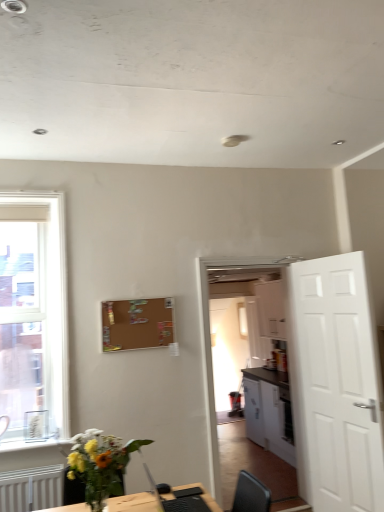
Describe the element at coordinates (268, 412) in the screenshot. I see `white glossy cabinet at center` at that location.

Image resolution: width=384 pixels, height=512 pixels. Describe the element at coordinates (178, 497) in the screenshot. I see `black plastic computer at lower center` at that location.

At what (x,y) coordinates should I click in order to perform the action: click on translucent glass vase at lower left. Please return your answer as a coordinate pair (x, y). This screenshot has width=384, height=512. Looking at the image, I should click on (98, 466).

Identify the location of clear glass window at left. Image resolution: width=384 pixels, height=512 pixels. (33, 312).

Image resolution: width=384 pixels, height=512 pixels. Describe the element at coordinates (33, 312) in the screenshot. I see `clear glass window at left` at that location.

Image resolution: width=384 pixels, height=512 pixels. In order to click on white glossy cabinet at center in this screenshot , I will do `click(268, 412)`.

From a real-world perspective, which object stands above the other?

white matte door at right.

Is white glossy cabinet at center in front of white matte door at right?

No, the depth of white glossy cabinet at center is greater than that of white matte door at right.

Does white glossy cabinet at center turn towards white matte door at right?

No, white glossy cabinet at center is not turned towards white matte door at right.

Considering the relative sizes of white glossy cabinet at center and white matte door at right in the image provided, is white glossy cabinet at center taller than white matte door at right?

In fact, white glossy cabinet at center may be shorter than white matte door at right.

This screenshot has width=384, height=512. Find the location of `computer behind the translucent glass vase at lower left`. computer behind the translucent glass vase at lower left is located at coordinates (178, 497).

Is black plastic computer at lower center not close to translucent glass vase at lower left?

That's not correct — black plastic computer at lower center is a little close to translucent glass vase at lower left.

Is black plastic computer at lower center surrounding translucent glass vase at lower left?

No, translucent glass vase at lower left is not inside black plastic computer at lower center.

Can you confirm if black plastic computer at lower center is thinner than translucent glass vase at lower left?

Yes, black plastic computer at lower center is thinner than translucent glass vase at lower left.

Between white glossy window sill at lower left and white glossy cabinet at center, which one has smaller size?

With smaller size is white glossy window sill at lower left.

Does white glossy window sill at lower left touch white glossy cabinet at center?

They are not placed beside each other.

How far apart are white glossy window sill at lower left and white glossy cabinet at center?

A distance of 10.42 feet exists between white glossy window sill at lower left and white glossy cabinet at center.

Is white glossy window sill at lower left oriented away from white glossy cabinet at center?

white glossy window sill at lower left is not turned away from white glossy cabinet at center.

Measure the distance between brown matte bulletin board at upper center and clear glass window at left.

brown matte bulletin board at upper center and clear glass window at left are 23.33 inches apart.

From the image's perspective, would you say brown matte bulletin board at upper center is shown under clear glass window at left?

Indeed, from the image's perspective, brown matte bulletin board at upper center is shown beneath clear glass window at left.

Where is `bulletin board below the clear glass window at left (from a real-world perspective)`? This screenshot has height=512, width=384. bulletin board below the clear glass window at left (from a real-world perspective) is located at coordinates (137, 324).

How many degrees apart are the facing directions of brown matte bulletin board at upper center and clear glass window at left?

0.755 degrees.

Between white glossy cabinet at center and white glossy window sill at lower left, which one appears on the left side from the viewer's perspective?

From the viewer's perspective, white glossy window sill at lower left appears more on the left side.

How different are the orientations of white glossy cabinet at center and white glossy window sill at lower left in degrees?

The facing directions of white glossy cabinet at center and white glossy window sill at lower left are 88.8 degrees apart.

Considering the positions of point (248, 424) and point (3, 449), is point (248, 424) closer or farther from the camera than point (3, 449)?

Point (248, 424) appears to be farther away from the viewer than point (3, 449).

In the image, is white glossy cabinet at center positioned in front of or behind white glossy window sill at lower left?

white glossy cabinet at center is positioned farther from the viewer than white glossy window sill at lower left.

Are white glossy window sill at lower left and black plastic computer at lower center making contact?

white glossy window sill at lower left and black plastic computer at lower center are not in contact.

Between white glossy window sill at lower left and black plastic computer at lower center, which one has larger size?

black plastic computer at lower center is bigger.

From a real-world perspective, is white glossy window sill at lower left positioned above or below black plastic computer at lower center?

From a real-world perspective, white glossy window sill at lower left is physically below black plastic computer at lower center.

Considering the relative positions of white glossy window sill at lower left and black plastic computer at lower center in the image provided, is white glossy window sill at lower left to the right of black plastic computer at lower center from the viewer's perspective?

No.

How distant is clear glass window at left from translucent glass vase at lower left?

clear glass window at left and translucent glass vase at lower left are 4.34 feet apart.

Does point (17, 285) lie in front of point (90, 429)?

No.

Relative to translucent glass vase at lower left, is clear glass window at left in front or behind?

clear glass window at left is positioned farther from the viewer than translucent glass vase at lower left.

Considering the sizes of objects clear glass window at left and translucent glass vase at lower left in the image provided, who is bigger, clear glass window at left or translucent glass vase at lower left?

With larger size is clear glass window at left.

At what (x,y) coordinates should I click in order to perform the action: click on door that appears above the white glossy cabinet at center (from a real-world perspective). Please return your answer as a coordinate pair (x, y). Looking at the image, I should click on (337, 384).

Where is `houseplant in front of the black plastic computer at lower center`? houseplant in front of the black plastic computer at lower center is located at coordinates [x=98, y=466].

Estimate the real-world distances between objects in this image. Which object is closer to brown matte bulletin board at upper center, black plastic computer at lower center or translucent glass vase at lower left?

black plastic computer at lower center is closer to brown matte bulletin board at upper center.

Based on their spatial positions, is white matte door at right or translucent glass vase at lower left closer to white glossy window sill at lower left?

translucent glass vase at lower left lies closer to white glossy window sill at lower left than the other object.

Based on their spatial positions, is white glossy window sill at lower left or white matte door at right closer to translucent glass vase at lower left?

white glossy window sill at lower left lies closer to translucent glass vase at lower left than the other object.

Which object lies nearer to the anchor point translucent glass vase at lower left, white glossy window sill at lower left or black plastic computer at lower center?

The object closer to translucent glass vase at lower left is black plastic computer at lower center.

Looking at the image, which one is located further to translucent glass vase at lower left, clear glass window at left or black plastic computer at lower center?

Among the two, clear glass window at left is located further to translucent glass vase at lower left.

Consider the image. Considering their positions, is white matte door at right positioned closer to clear glass window at left than translucent glass vase at lower left?

Among the two, translucent glass vase at lower left is located nearer to clear glass window at left.

Considering their positions, is clear glass window at left positioned further to white matte door at right than black plastic computer at lower center?

The object further to white matte door at right is clear glass window at left.

Looking at the image, which one is located further to brown matte bulletin board at upper center, white glossy window sill at lower left or black plastic computer at lower center?

Based on the image, black plastic computer at lower center appears to be further to brown matte bulletin board at upper center.

Identify the location of computer positioned between translucent glass vase at lower left and clear glass window at left from near to far. The width and height of the screenshot is (384, 512). (178, 497).

At what (x,y) coordinates should I click in order to perform the action: click on window sill between translucent glass vase at lower left and brown matte bulletin board at upper center in the front-back direction. Please return your answer as a coordinate pair (x, y). Looking at the image, I should click on (33, 444).

At what (x,y) coordinates should I click in order to perform the action: click on window positioned between black plastic computer at lower center and brown matte bulletin board at upper center from near to far. Please return your answer as a coordinate pair (x, y). Image resolution: width=384 pixels, height=512 pixels. Looking at the image, I should click on (33, 312).

At what (x,y) coordinates should I click in order to perform the action: click on bulletin board between white glossy window sill at lower left and white matte door at right in the horizontal direction. Please return your answer as a coordinate pair (x, y). Image resolution: width=384 pixels, height=512 pixels. Looking at the image, I should click on (137, 324).